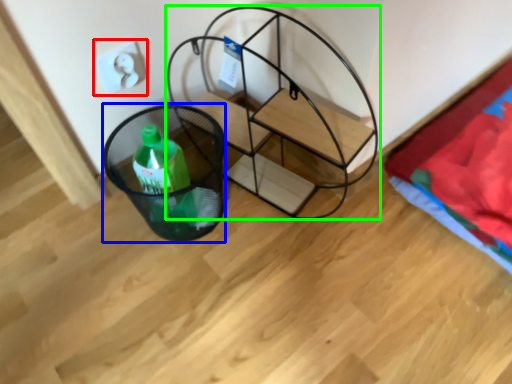
Question: Which object is positioned closest to electric outlet (highlighted by a red box)? Select from basket (highlighted by a blue box) and furniture (highlighted by a green box).

Choices:
 (A) basket
 (B) furniture

Answer: (A)